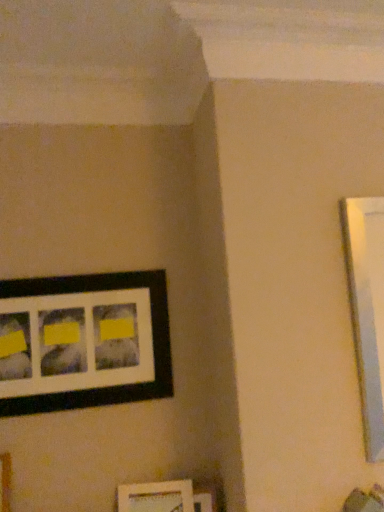
In order to face matte black picture frame at upper left, positioned as the third picture frame in bottom-to-top order, should I rotate leftwards or rightwards?

You should look left and rotate roughly 13.555 degrees.

The width and height of the screenshot is (384, 512). What are the coordinates of `white matte picture frame at lower center, the second picture frame ordered from the bottom` in the screenshot? It's located at (156, 497).

Between matte black picture frame at upper left, which is counted as the first picture frame, starting from the top, and matte black picture frame at lower center, which ranks as the 3th picture frame in top-to-bottom order, which one appears on the left side from the viewer's perspective?

From the viewer's perspective, matte black picture frame at upper left, which is counted as the first picture frame, starting from the top, appears more on the left side.

Who is more distant, matte black picture frame at upper left, which is counted as the first picture frame, starting from the top, or matte black picture frame at lower center, the first picture frame ordered from the bottom?

Positioned behind is matte black picture frame at lower center, the first picture frame ordered from the bottom.

From the image's perspective, who appears lower, matte black picture frame at upper left, positioned as the third picture frame in bottom-to-top order, or matte black picture frame at lower center, which ranks as the 3th picture frame in top-to-bottom order?

From the image's view, matte black picture frame at lower center, which ranks as the 3th picture frame in top-to-bottom order, is below.

From a real-world perspective, is matte black picture frame at upper left, which is counted as the first picture frame, starting from the top, physically located above or below white matte picture frame at lower center, the 2th picture frame positioned from the top?

Clearly, from a real-world perspective, matte black picture frame at upper left, which is counted as the first picture frame, starting from the top, is above white matte picture frame at lower center, the 2th picture frame positioned from the top.

Is matte black picture frame at upper left, which is counted as the first picture frame, starting from the top, spatially inside white matte picture frame at lower center, the 2th picture frame positioned from the top, or outside of it?

matte black picture frame at upper left, which is counted as the first picture frame, starting from the top, is not inside white matte picture frame at lower center, the 2th picture frame positioned from the top, it's outside.

Consider the image. Considering the relative sizes of matte black picture frame at upper left, which is counted as the first picture frame, starting from the top, and white matte picture frame at lower center, the second picture frame ordered from the bottom, in the image provided, is matte black picture frame at upper left, which is counted as the first picture frame, starting from the top, thinner than white matte picture frame at lower center, the second picture frame ordered from the bottom,?

Yes, matte black picture frame at upper left, which is counted as the first picture frame, starting from the top, is thinner than white matte picture frame at lower center, the second picture frame ordered from the bottom.

Considering the relative sizes of white matte picture frame at lower center, the second picture frame ordered from the bottom, and matte black picture frame at lower center, the first picture frame ordered from the bottom, in the image provided, is white matte picture frame at lower center, the second picture frame ordered from the bottom, taller than matte black picture frame at lower center, the first picture frame ordered from the bottom,?

No, white matte picture frame at lower center, the second picture frame ordered from the bottom, is not taller than matte black picture frame at lower center, the first picture frame ordered from the bottom.

Which is correct: white matte picture frame at lower center, the 2th picture frame positioned from the top, is inside matte black picture frame at lower center, the first picture frame ordered from the bottom, or outside of it?

white matte picture frame at lower center, the 2th picture frame positioned from the top, cannot be found inside matte black picture frame at lower center, the first picture frame ordered from the bottom.

Is point (171, 484) positioned after point (209, 497)?

Yes, point (171, 484) is behind point (209, 497).

Is white matte picture frame at lower center, the 2th picture frame positioned from the top, not close to matte black picture frame at lower center, the first picture frame ordered from the bottom?

They are positioned close to each other.

At what (x,y) coordinates should I click in order to perform the action: click on picture frame that is below the white matte picture frame at lower center, the second picture frame ordered from the bottom (from the image's perspective). Please return your answer as a coordinate pair (x, y). Image resolution: width=384 pixels, height=512 pixels. Looking at the image, I should click on (203, 502).

From the image's perspective, which one is positioned higher, matte black picture frame at lower center, which ranks as the 3th picture frame in top-to-bottom order, or white matte picture frame at lower center, the 2th picture frame positioned from the top?

From the image's view, white matte picture frame at lower center, the 2th picture frame positioned from the top, is above.

Which is more distant, [209,511] or [146,507]?

Point [146,507]

Between white matte picture frame at lower center, the 2th picture frame positioned from the top, and matte black picture frame at upper left, positioned as the third picture frame in bottom-to-top order, which one has less height?

With less height is white matte picture frame at lower center, the 2th picture frame positioned from the top.

Looking at this image, from the image's perspective, which is above, white matte picture frame at lower center, the second picture frame ordered from the bottom, or matte black picture frame at upper left, which is counted as the first picture frame, starting from the top?

matte black picture frame at upper left, which is counted as the first picture frame, starting from the top, from the image's perspective.

Considering the positions of points (135, 500) and (166, 379), is point (135, 500) farther from camera compared to point (166, 379)?

No.

Image resolution: width=384 pixels, height=512 pixels. There is a white matte picture frame at lower center, the second picture frame ordered from the bottom. Identify the location of picture frame above it (from a real-world perspective). (83, 341).

Is point (194, 505) more distant than point (71, 409)?

That is False.

Based on the photo, from the image's perspective, is matte black picture frame at lower center, the first picture frame ordered from the bottom, on matte black picture frame at upper left, positioned as the third picture frame in bottom-to-top order?

No.

Can you confirm if matte black picture frame at lower center, which ranks as the 3th picture frame in top-to-bottom order, is wider than matte black picture frame at upper left, which is counted as the first picture frame, starting from the top?

In fact, matte black picture frame at lower center, which ranks as the 3th picture frame in top-to-bottom order, might be narrower than matte black picture frame at upper left, which is counted as the first picture frame, starting from the top.

Where is `the 2nd picture frame above when counting from the matte black picture frame at lower center, the first picture frame ordered from the bottom (from the image's perspective)`? The height and width of the screenshot is (512, 384). the 2nd picture frame above when counting from the matte black picture frame at lower center, the first picture frame ordered from the bottom (from the image's perspective) is located at coordinates (83, 341).

There is a matte black picture frame at upper left, positioned as the third picture frame in bottom-to-top order. Identify the location of the 2nd picture frame below it (from the image's perspective). The image size is (384, 512). (203, 502).

Which picture frame is the 1st one when counting from the right side of the matte black picture frame at upper left, positioned as the third picture frame in bottom-to-top order? Please provide its 2D coordinates.

[(156, 497)]

Considering their positions, is white matte picture frame at lower center, the 2th picture frame positioned from the top, positioned closer to matte black picture frame at upper left, which is counted as the first picture frame, starting from the top, than matte black picture frame at lower center, which ranks as the 3th picture frame in top-to-bottom order?

white matte picture frame at lower center, the 2th picture frame positioned from the top, lies closer to matte black picture frame at upper left, which is counted as the first picture frame, starting from the top, than the other object.

Based on the photo, which object lies nearer to the anchor point matte black picture frame at lower center, the first picture frame ordered from the bottom, matte black picture frame at upper left, positioned as the third picture frame in bottom-to-top order, or white matte picture frame at lower center, the 2th picture frame positioned from the top?

Based on the image, white matte picture frame at lower center, the 2th picture frame positioned from the top, appears to be nearer to matte black picture frame at lower center, the first picture frame ordered from the bottom.

Based on their spatial positions, is white matte picture frame at lower center, the 2th picture frame positioned from the top, or matte black picture frame at upper left, positioned as the third picture frame in bottom-to-top order, further from matte black picture frame at lower center, which ranks as the 3th picture frame in top-to-bottom order?

The object further to matte black picture frame at lower center, which ranks as the 3th picture frame in top-to-bottom order, is matte black picture frame at upper left, positioned as the third picture frame in bottom-to-top order.

Considering their positions, is matte black picture frame at upper left, positioned as the third picture frame in bottom-to-top order, positioned closer to white matte picture frame at lower center, the second picture frame ordered from the bottom, than matte black picture frame at lower center, which ranks as the 3th picture frame in top-to-bottom order?

matte black picture frame at lower center, which ranks as the 3th picture frame in top-to-bottom order.

Considering their positions, is matte black picture frame at lower center, the first picture frame ordered from the bottom, positioned closer to matte black picture frame at upper left, positioned as the third picture frame in bottom-to-top order, than white matte picture frame at lower center, the second picture frame ordered from the bottom?

white matte picture frame at lower center, the second picture frame ordered from the bottom, lies closer to matte black picture frame at upper left, positioned as the third picture frame in bottom-to-top order, than the other object.

Based on their spatial positions, is matte black picture frame at lower center, which ranks as the 3th picture frame in top-to-bottom order, or matte black picture frame at upper left, which is counted as the first picture frame, starting from the top, further from white matte picture frame at lower center, the second picture frame ordered from the bottom?

matte black picture frame at upper left, which is counted as the first picture frame, starting from the top, is positioned further to the anchor white matte picture frame at lower center, the second picture frame ordered from the bottom.

Locate an element on the screen. This screenshot has width=384, height=512. picture frame that lies between matte black picture frame at upper left, which is counted as the first picture frame, starting from the top, and matte black picture frame at lower center, the first picture frame ordered from the bottom, from top to bottom is located at coordinates (156, 497).